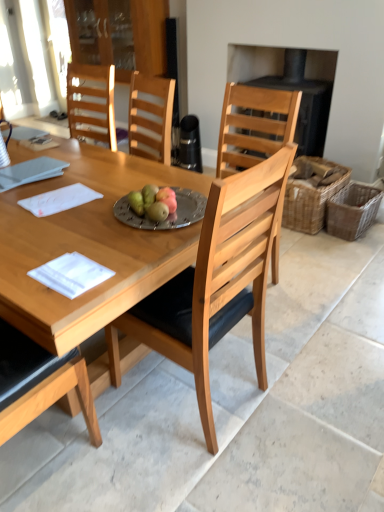
What are the coordinates of `vacant space in between silver metallic plate at center and white paper at center, the third notepad from the top` in the screenshot? It's located at (119, 240).